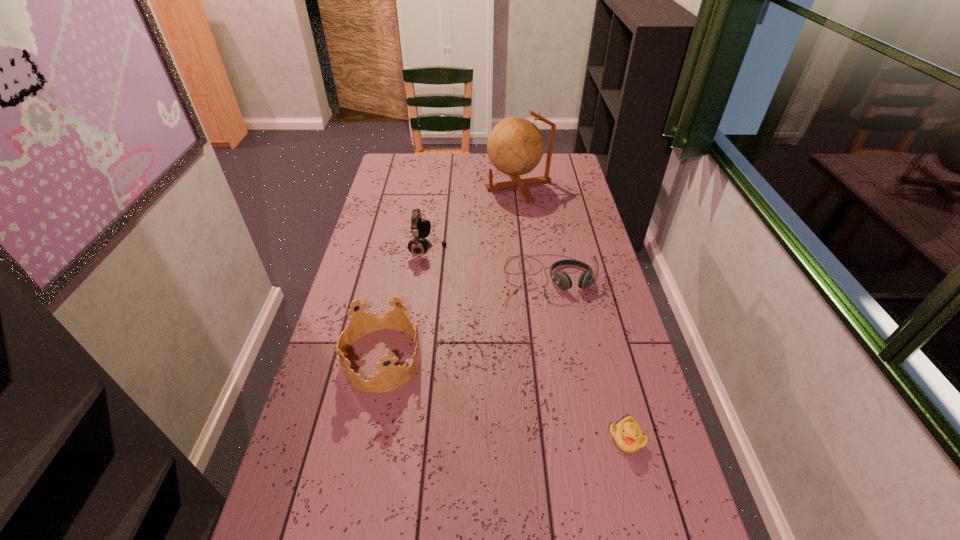
Locate an element on the screen. The image size is (960, 540). free point between the taller headset and the fourth tallest object is located at coordinates (488, 264).

Where is `free space between the left headset and the shortest object`? The width and height of the screenshot is (960, 540). free space between the left headset and the shortest object is located at coordinates (527, 343).

Find the location of a particular element. This screenshot has width=960, height=540. vacant space in between the tiara and the left headset is located at coordinates (405, 303).

In order to click on free space between the duckling and the tiara in this screenshot , I will do `click(504, 399)`.

Locate which object ranks third in proximity to the tiara. Please provide its 2D coordinates. Your answer should be formatted as a tuple, i.e. [(x, y)], where the tuple contains the x and y coordinates of a point satisfying the conditions above.

[(627, 434)]

Choose which object is the fourth nearest neighbor to the shorter headset. Please provide its 2D coordinates. Your answer should be formatted as a tuple, i.e. [(x, y)], where the tuple contains the x and y coordinates of a point satisfying the conditions above.

[(627, 434)]

Find the location of a particular element. vacant position in the image that satisfies the following two spatial constraints: 1. on the outer surface of the fourth tallest object; 2. on the front-facing side of the fourth farthest object is located at coordinates (560, 359).

Where is `free space that satisfies the following two spatial constraints: 1. on the outer surface of the right headset; 2. on the front-facing side of the fourth farthest object`? This screenshot has width=960, height=540. free space that satisfies the following two spatial constraints: 1. on the outer surface of the right headset; 2. on the front-facing side of the fourth farthest object is located at coordinates (560, 359).

The height and width of the screenshot is (540, 960). What are the coordinates of `vacant area in the image that satisfies the following two spatial constraints: 1. on the outer surface of the shorter headset; 2. on the front-facing side of the tiara` in the screenshot? It's located at (560, 359).

At what (x,y) coordinates should I click in order to perform the action: click on free spot that satisfies the following two spatial constraints: 1. on the outer surface of the fourth tallest object; 2. on the front-facing side of the tiara. Please return your answer as a coordinate pair (x, y). Looking at the image, I should click on [x=560, y=359].